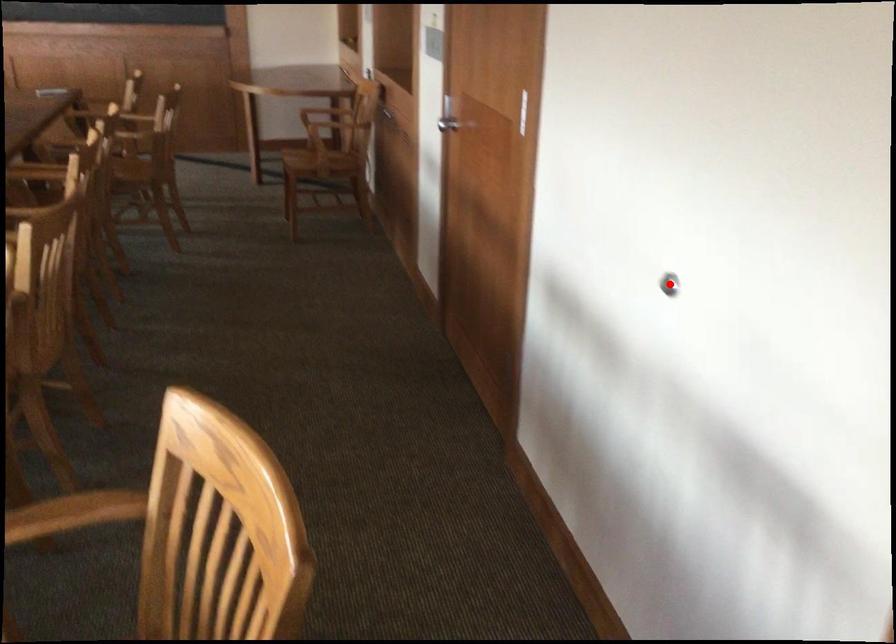
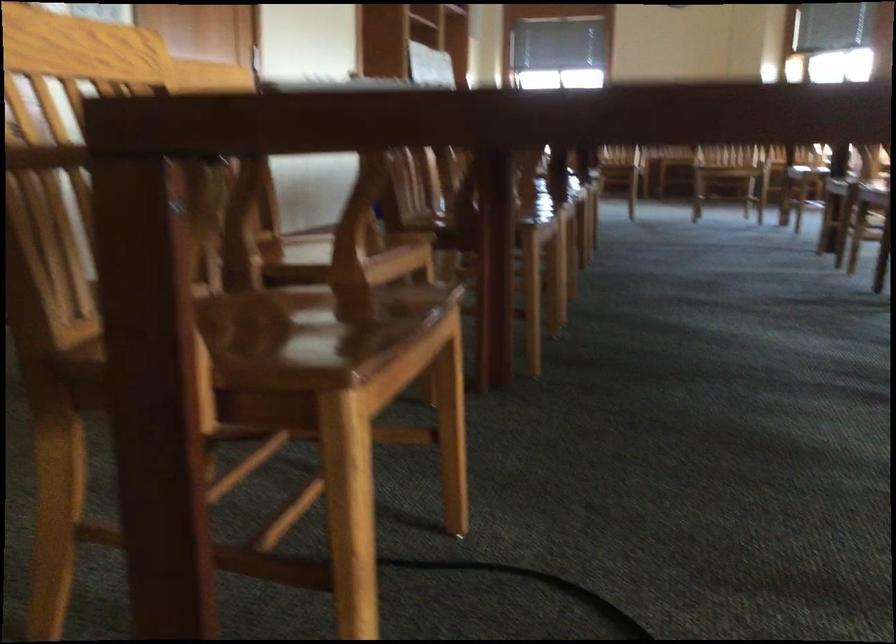
Question: I am providing you with two images of the same scene from different viewpoints. A red point is marked on the first image. Can you still see the location of the red point in image 2?

Choices:
 (A) Yes
 (B) No

Answer: (B)